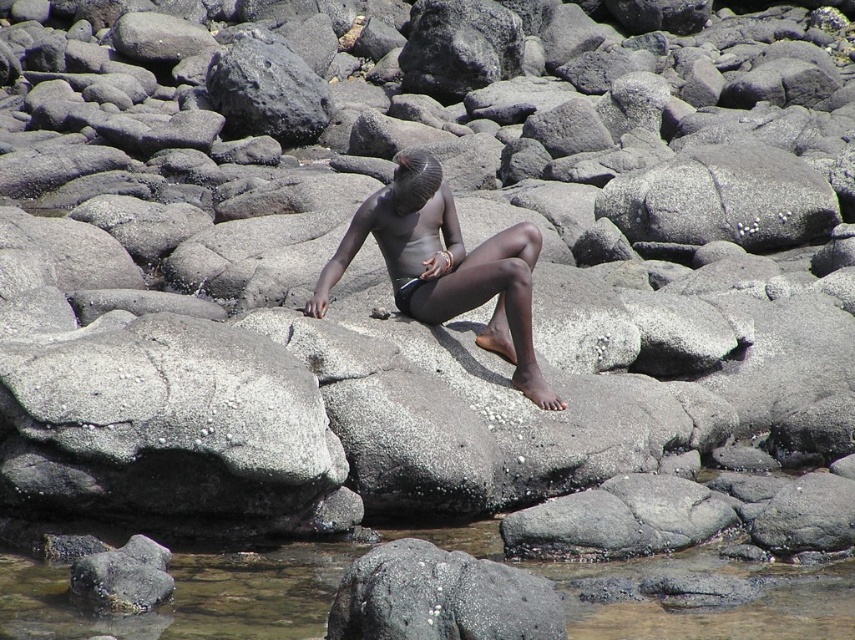
Question: Which of the following is the closest to the observer?

Choices:
 (A) (233, 605)
 (B) (523, 275)

Answer: (A)

Question: Which of the following is the farthest from the observer?

Choices:
 (A) matte black skin at center
 (B) clear water at river bottom left

Answer: (A)

Question: In this image, where is clear water at river bottom left located relative to matte black skin at center?

Choices:
 (A) right
 (B) left

Answer: (B)

Question: Is clear water at river bottom left above matte black skin at center?

Choices:
 (A) no
 (B) yes

Answer: (A)

Question: Does clear water at river bottom left have a greater width compared to matte black skin at center?

Choices:
 (A) no
 (B) yes

Answer: (A)

Question: Which point appears farthest from the camera in this image?

Choices:
 (A) (360, 205)
 (B) (316, 616)

Answer: (A)